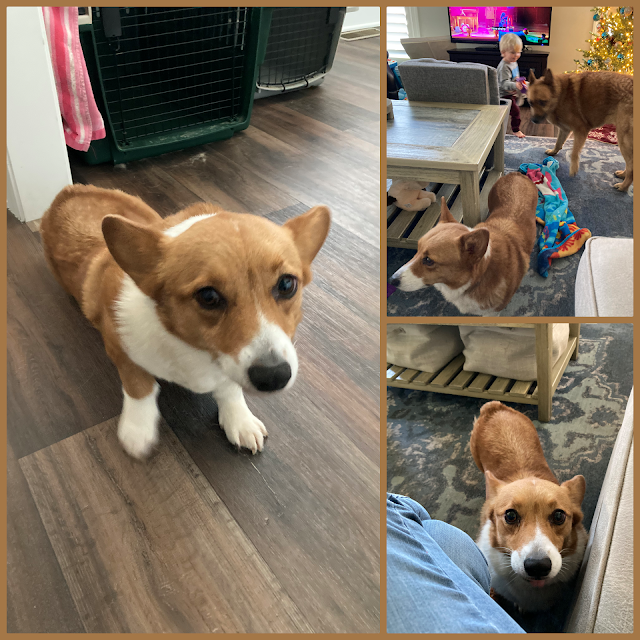
You are a GUI agent. You are given a task and a screenshot of the screen. Output one action in this format:
    pyautogui.click(x=<x>, y=<y>)
    Task: Click on the wooden floor
    This screenshot has height=640, width=640.
    Given the screenshot: What is the action you would take?
    point(249,550), point(540,127)